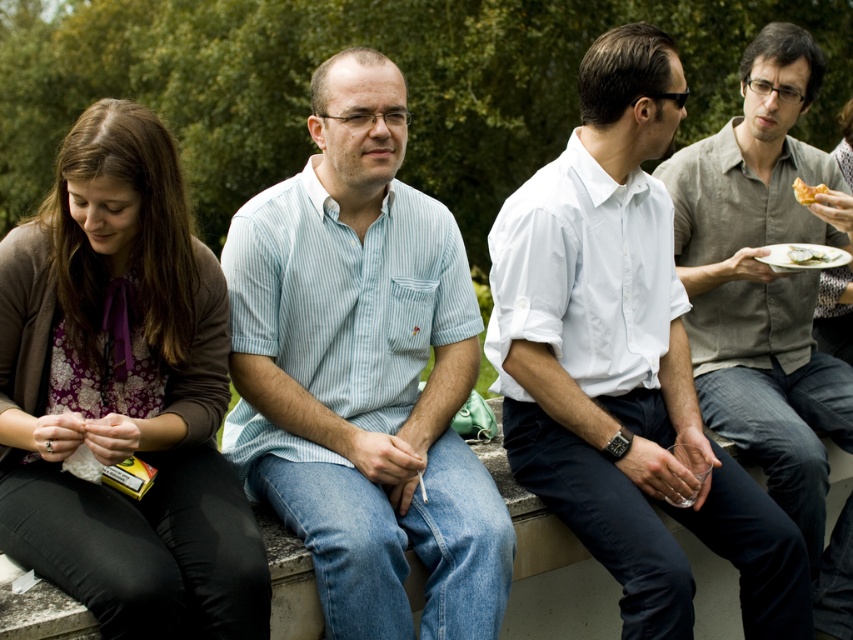
What is the 2D coordinate of the matte gray shirt at right?

The matte gray shirt at right is located at point (769, 300).